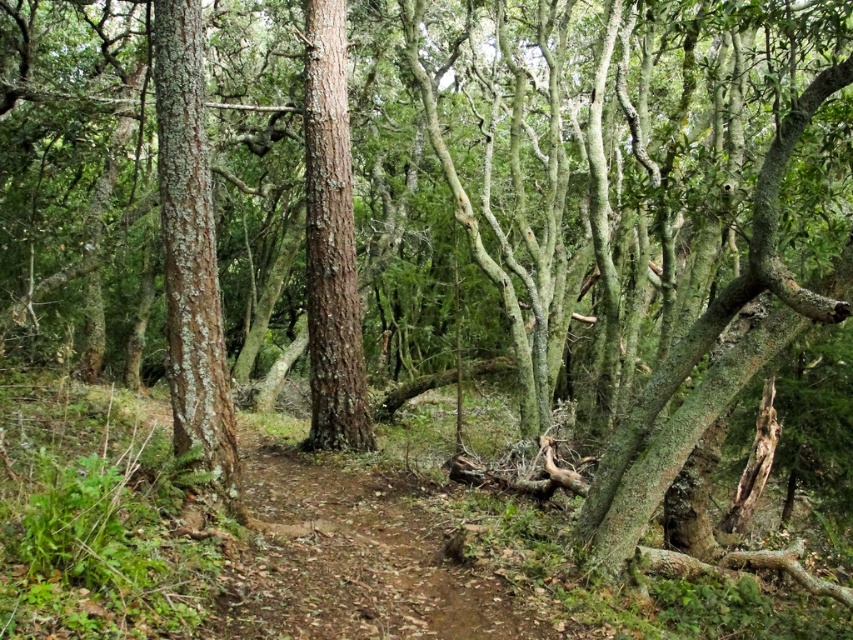
You are standing on the narrow dirt path in the center of the forest. There are two points marked on the path, one at coordinates point [173,221] and another at point [344,426]. Which point is closer to you?

Point [173,221] is closer to the viewer than point [344,426].